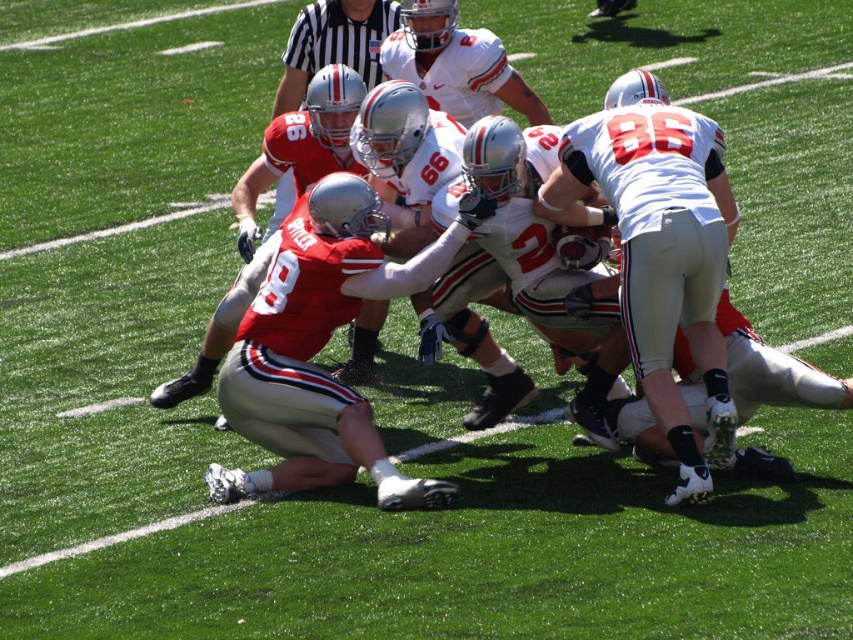
You are a sports analyst watching the game. You notice two items in the image, the matte silver helmet at center and the black striped shirt at upper center. Which of these two items appears narrower in the image?

The matte silver helmet at center appears narrower than the black striped shirt at upper center because its width is less than the shirt.

You are a referee standing at the center of the field. You need to determine which of the two points, point (393,44) or point (378,80), is closer to you. Based on the scene, which one is closer?

Point (393,44) is closer to the viewer than point (378,80).